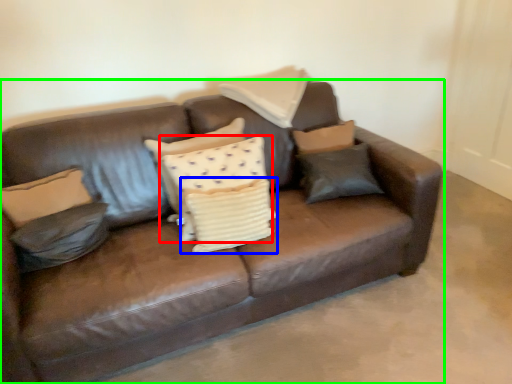
Question: Considering the real-world distances, which object is farthest from pillow (highlighted by a red box)? pillow (highlighted by a blue box) or studio couch (highlighted by a green box)?

Choices:
 (A) pillow
 (B) studio couch

Answer: (B)